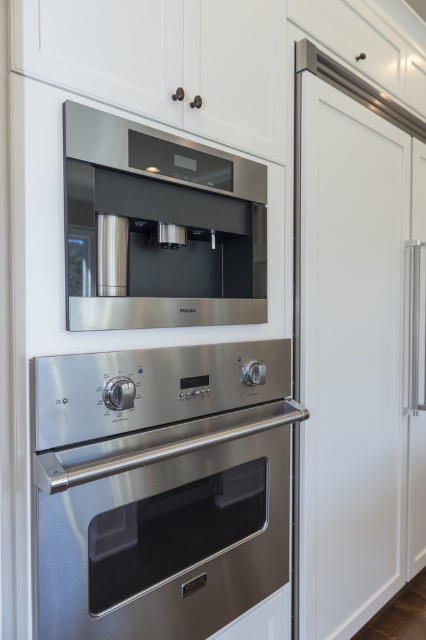
Can you confirm if stainless steel oven at lower center is bigger than stainless steel coffee machine at upper center?

Correct, stainless steel oven at lower center is larger in size than stainless steel coffee machine at upper center.

Describe the element at coordinates (161, 486) in the screenshot. The image size is (426, 640). I see `stainless steel oven at lower center` at that location.

Who is more forward, (x=204, y=605) or (x=74, y=257)?

Positioned in front is point (x=74, y=257).

Identify the location of stainless steel oven at lower center. Image resolution: width=426 pixels, height=640 pixels. (161, 486).

Who is positioned more to the right, stainless steel coffee machine at upper center or stainless steel exhaust hood at upper center?

stainless steel exhaust hood at upper center

In order to click on stainless steel coffee machine at upper center in this screenshot , I will do `click(160, 228)`.

Can you confirm if stainless steel oven at lower center is wider than stainless steel exhaust hood at upper center?

Yes, stainless steel oven at lower center is wider than stainless steel exhaust hood at upper center.

From the picture: Between stainless steel oven at lower center and stainless steel exhaust hood at upper center, which one is positioned higher?

stainless steel exhaust hood at upper center is higher up.

Image resolution: width=426 pixels, height=640 pixels. In order to click on stainless steel oven at lower center in this screenshot , I will do `click(161, 486)`.

This screenshot has height=640, width=426. Find the location of `stainless steel oven at lower center`. stainless steel oven at lower center is located at coordinates (161, 486).